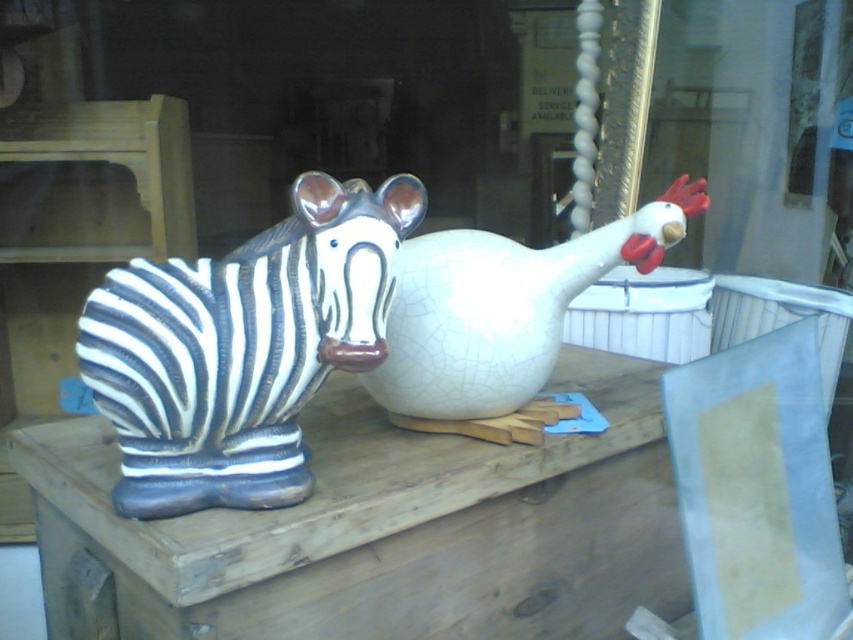
You are a customer looking at the shop window. There is a crackle glaze zebra at center represented by point (241, 348). Can you see the crackle glaze zebra at center from your current position outside the shop?

The crackle glaze zebra at center is represented by point (241, 348), so yes, you can see the crackle glaze zebra at center from your current position outside the shop because it is displayed in the shop window.

You are a customer in the shop and want to place both the crackle glaze zebra at center and the cracked white vase at center on your shelf at home. Your shelf has limited space, and you need to know which one takes up less space. Which figurine should you choose?

The crackle glaze zebra at center is smaller than the cracked white vase at center, so it takes up less space and should be chosen.